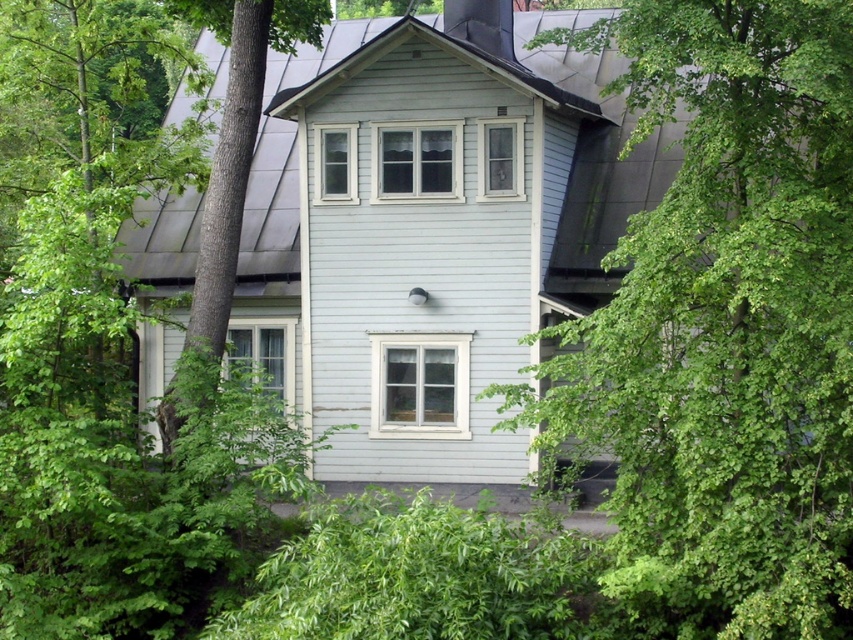
Question: Which point is farther to the camera?

Choices:
 (A) (843, 364)
 (B) (207, 1)

Answer: (B)

Question: Is green leafy tree at center below green leafy tree at left?

Choices:
 (A) yes
 (B) no

Answer: (A)

Question: Is green leafy tree at center wider than green leafy tree at left?

Choices:
 (A) yes
 (B) no

Answer: (A)

Question: Is green leafy tree at center above green leafy tree at left?

Choices:
 (A) no
 (B) yes

Answer: (A)